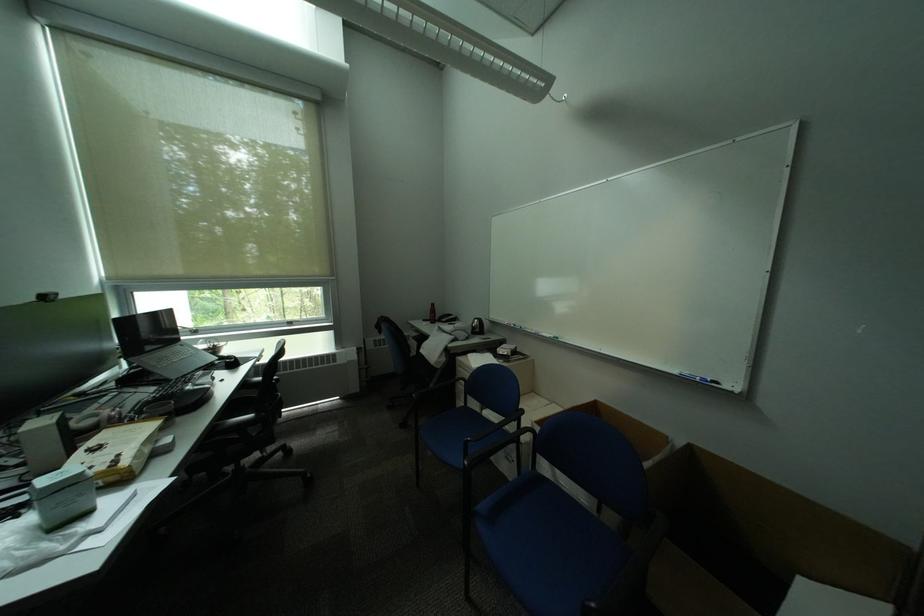
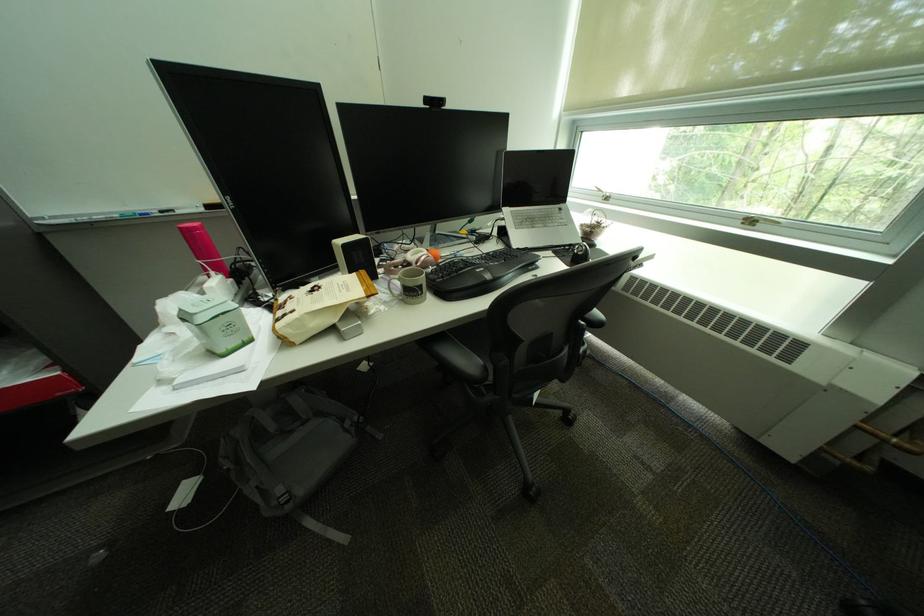
Find the pixel in the second image that matches point (103, 508) in the first image.

(232, 353)